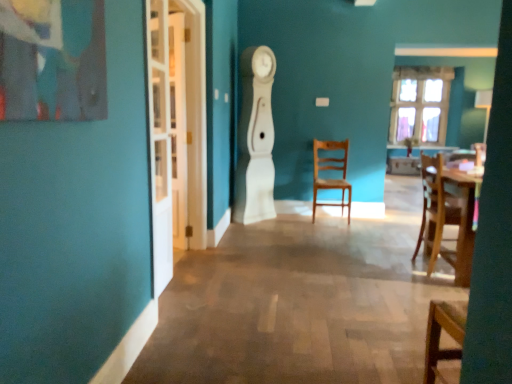
Question: Does wooden chair at center lie behind clear glass window at upper right?

Choices:
 (A) no
 (B) yes

Answer: (A)

Question: Does wooden chair at center appear on the right side of clear glass window at upper right?

Choices:
 (A) yes
 (B) no

Answer: (B)

Question: Is wooden chair at center looking in the opposite direction of clear glass window at upper right?

Choices:
 (A) yes
 (B) no

Answer: (B)

Question: From a real-world perspective, is wooden chair at center physically above clear glass window at upper right?

Choices:
 (A) yes
 (B) no

Answer: (B)

Question: Is there a large distance between wooden chair at center and clear glass window at upper right?

Choices:
 (A) no
 (B) yes

Answer: (B)

Question: Could clear glass window at upper right be considered to be inside wooden chair at center?

Choices:
 (A) no
 (B) yes

Answer: (A)

Question: Does wooden chair at center lie behind white glass door at left?

Choices:
 (A) no
 (B) yes

Answer: (B)

Question: Is wooden chair at center wider than white glass door at left?

Choices:
 (A) no
 (B) yes

Answer: (B)

Question: Does wooden chair at center have a larger size compared to white glass door at left?

Choices:
 (A) yes
 (B) no

Answer: (A)

Question: From a real-world perspective, is wooden chair at center under white glass door at left?

Choices:
 (A) yes
 (B) no

Answer: (A)

Question: From the image's perspective, is wooden chair at center above white glass door at left?

Choices:
 (A) no
 (B) yes

Answer: (A)

Question: Is wooden chair at center looking in the opposite direction of white glass door at left?

Choices:
 (A) yes
 (B) no

Answer: (B)

Question: Is white glossy clock at center outside of white glass door at left?

Choices:
 (A) yes
 (B) no

Answer: (A)